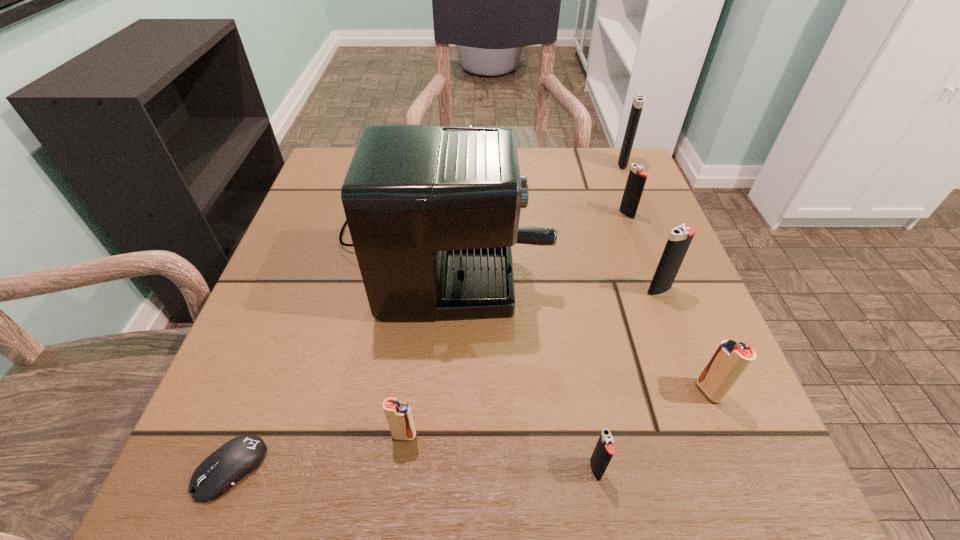
This screenshot has width=960, height=540. I want to click on coffee maker, so click(x=433, y=211).

This screenshot has width=960, height=540. What are the coordinates of `black coffee maker` in the screenshot? It's located at (433, 211).

This screenshot has height=540, width=960. In order to click on the farthest igniter in this screenshot , I will do `click(637, 105)`.

Locate an element on the screen. The height and width of the screenshot is (540, 960). the biggest black igniter is located at coordinates (637, 105).

Where is `the third tallest object`? Image resolution: width=960 pixels, height=540 pixels. the third tallest object is located at coordinates (680, 238).

I want to click on the second nearest black igniter, so click(x=680, y=238).

I want to click on the second farthest black igniter, so click(636, 180).

What are the coordinates of `the fifth nearest igniter` in the screenshot? It's located at [636, 180].

Locate an element on the screen. the fifth farthest object is located at coordinates (730, 361).

This screenshot has height=540, width=960. Find the location of `the farther red igniter`. the farther red igniter is located at coordinates (730, 361).